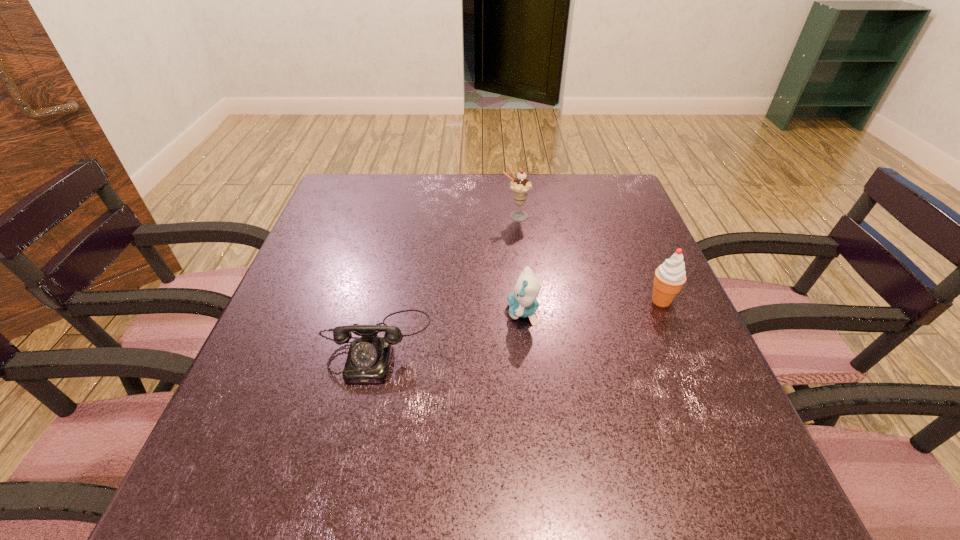
The image size is (960, 540). Identify the location of vacant area located on the face of the kitten. (405, 312).

Where is `vacant space located on the face of the kitten`? The height and width of the screenshot is (540, 960). vacant space located on the face of the kitten is located at coordinates (318, 312).

Where is `blank space located on the front-facing side of the leftmost object`? This screenshot has width=960, height=540. blank space located on the front-facing side of the leftmost object is located at coordinates (361, 415).

The image size is (960, 540). What are the coordinates of `object that is at the far edge` in the screenshot? It's located at (520, 186).

Locate an element on the screen. This screenshot has height=540, width=960. object situated at the left edge is located at coordinates (368, 360).

The height and width of the screenshot is (540, 960). Identify the location of object located at the right edge. (x=670, y=276).

Identify the location of vacant area at the far edge of the desktop. (564, 193).

You are a GUI agent. You are given a task and a screenshot of the screen. Output one action in this format:
    pyautogui.click(x=<x>, y=<y>)
    Task: Click on the vacant space at the near edge of the desktop
    The width and height of the screenshot is (960, 540).
    Given the screenshot: What is the action you would take?
    (639, 464)

In the image, there is a desktop. Where is `free space at the left edge`? free space at the left edge is located at coordinates (360, 266).

The width and height of the screenshot is (960, 540). Find the location of `vacant space at the right edge of the desktop`. vacant space at the right edge of the desktop is located at coordinates (608, 235).